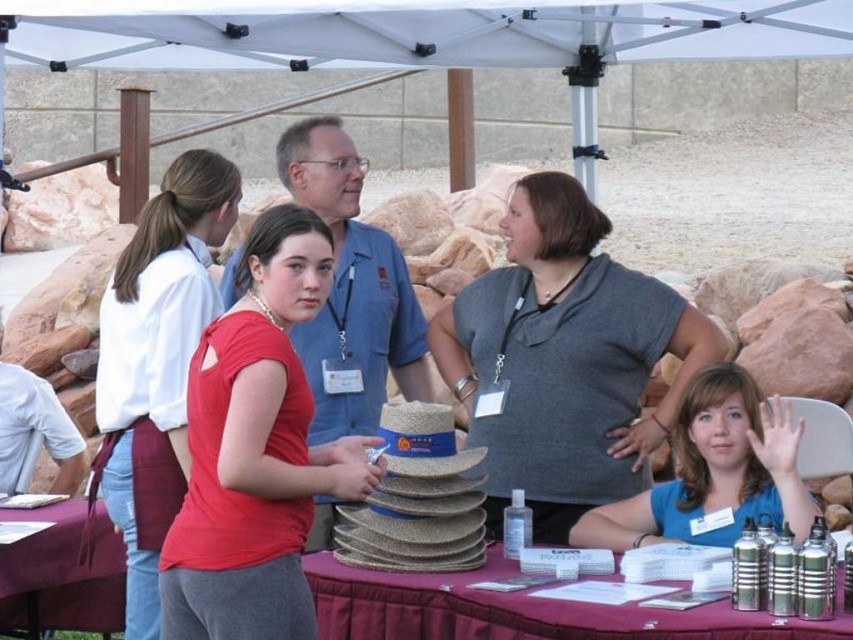
You are at the event and need to locate the metallic silver water bottles at lower right. According to the scene description, where exactly are they positioned?

The metallic silver water bottles at lower right are positioned at point (517, 611).

Looking at this image, you are setting up a booth at an outdoor event. You have a metallic silver water bottles at lower right and a blue fabric shirt at center. Which object takes up more space in the scene?

The blue fabric shirt at center takes up more space in the scene because the metallic silver water bottles at lower right is smaller than it.